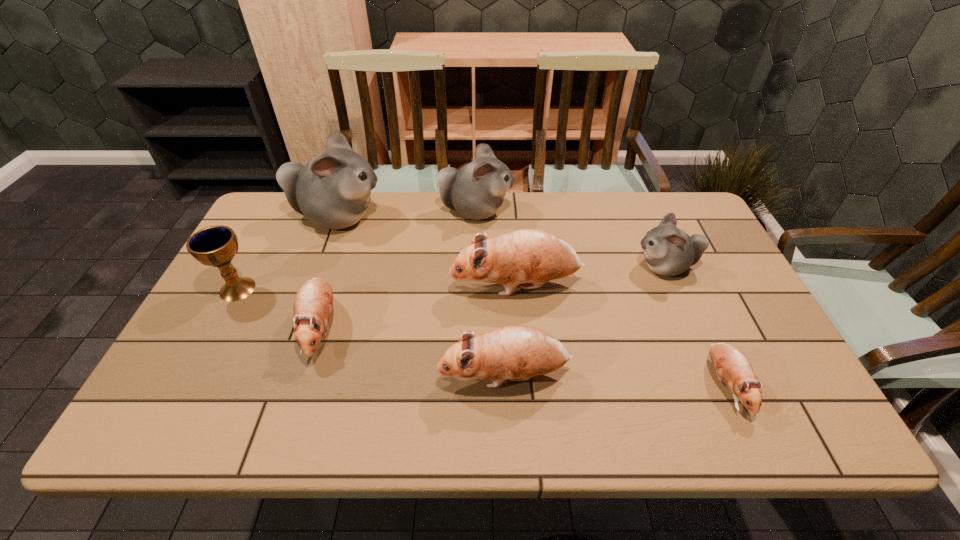
You are a GUI agent. You are given a task and a screenshot of the screen. Output one action in this format:
    pyautogui.click(x=<x>, y=<y>)
    Task: Click on the vacant space located 0.380m on the face of the nearest white hamster
    This screenshot has height=540, width=960.
    Given the screenshot: What is the action you would take?
    point(500,267)

Find the location of a particular element. This screenshot has height=540, width=960. free space located 0.070m at the face of the third smallest brown hamster is located at coordinates (408, 376).

I want to click on vacant space situated at the face of the third smallest brown hamster, so click(391, 376).

Image resolution: width=960 pixels, height=540 pixels. What are the coordinates of `vacant region located at the face of the third smallest brown hamster` in the screenshot? It's located at (387, 376).

The image size is (960, 540). In order to click on vacant space positioned 0.120m at the face of the second shortest hamster in this screenshot , I will do `click(291, 417)`.

Where is `object present at the near edge`? This screenshot has width=960, height=540. object present at the near edge is located at coordinates (731, 365).

The width and height of the screenshot is (960, 540). What are the coordinates of `hamster situated at the left edge` in the screenshot? It's located at (333, 190).

Where is `chalice that is positioned at the left edge`? This screenshot has height=540, width=960. chalice that is positioned at the left edge is located at coordinates [x=216, y=246].

At what (x,y) coordinates should I click in order to perform the action: click on object that is at the far left corner. Please return your answer as a coordinate pair (x, y). This screenshot has height=540, width=960. Looking at the image, I should click on (333, 190).

Locate an element on the screen. object at the near right corner is located at coordinates (731, 365).